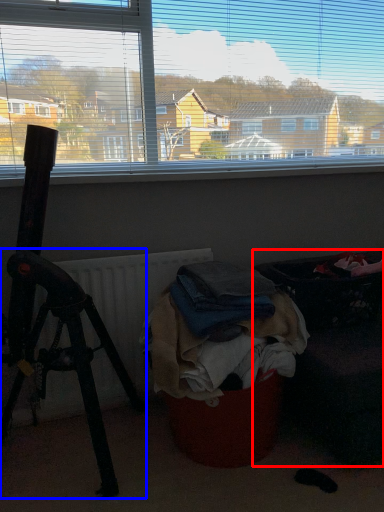
Question: Among these objects, which one is farthest to the camera, furniture (highlighted by a red box) or tripod (highlighted by a blue box)?

Choices:
 (A) furniture
 (B) tripod

Answer: (A)